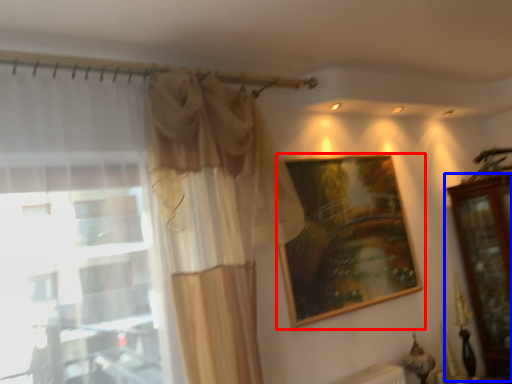
Question: Among these objects, which one is farthest to the camera, picture frame (highlighted by a red box) or dresser (highlighted by a blue box)?

Choices:
 (A) picture frame
 (B) dresser

Answer: (B)